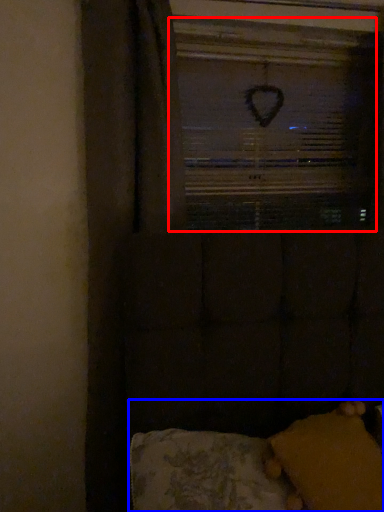
Question: Which object appears farthest to the camera in this image, window screen (highlighted by a red box) or furniture (highlighted by a blue box)?

Choices:
 (A) window screen
 (B) furniture

Answer: (A)